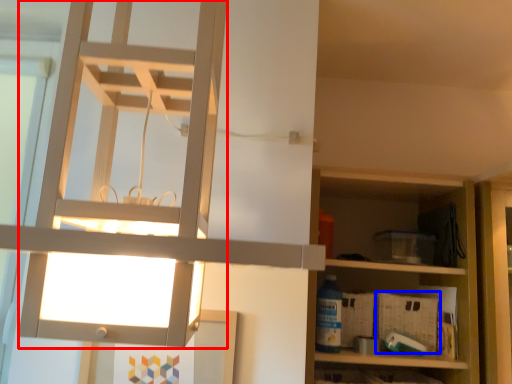
Question: Which of the following is the farthest to the observer, lamp (highlighted by a red box) or crate (highlighted by a blue box)?

Choices:
 (A) lamp
 (B) crate

Answer: (B)